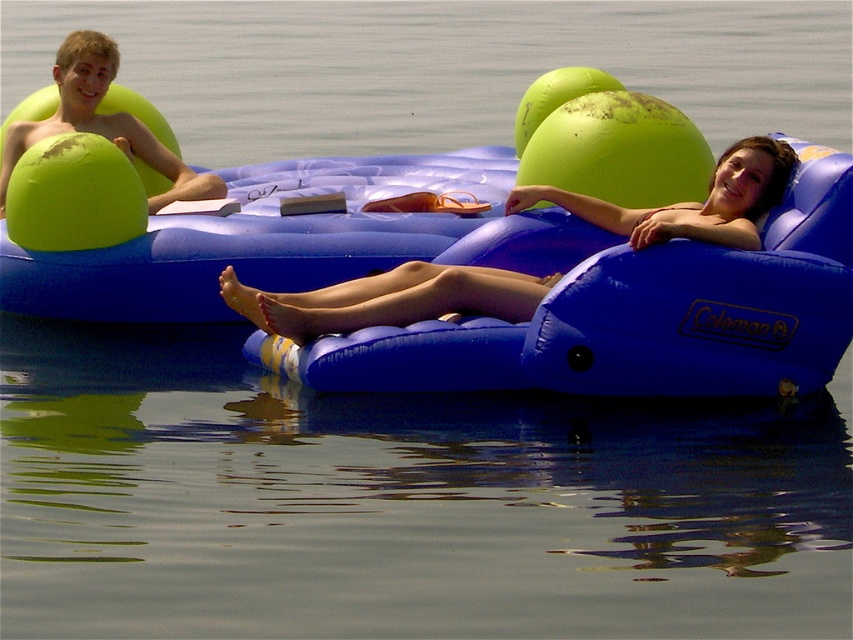
You are a swimmer who wants to reach the green rubber ball at upper center and the matte blue inflatable chair at center. Which object is wider?

The green rubber ball at upper center is wider than the matte blue inflatable chair at center according to the description.

You are planning to bring a large beach towel to place on one of the inflatables. Which object, the matte blue inflatable chair at center or the matte green ball at upper left, can accommodate the beach towel more comfortably?

The matte blue inflatable chair at center has a larger size compared to the matte green ball at upper left, so it can accommodate the beach towel more comfortably.

You are standing on the shore of a lake and see the matte blue inflatable chair at center floating in the water. If you want to reach it, would you need a boat or can you walk to it?

The matte blue inflatable chair at center is 33.91 meters away from viewer. Since it is located in the water, you would need a boat to reach it unless you can swim that distance.